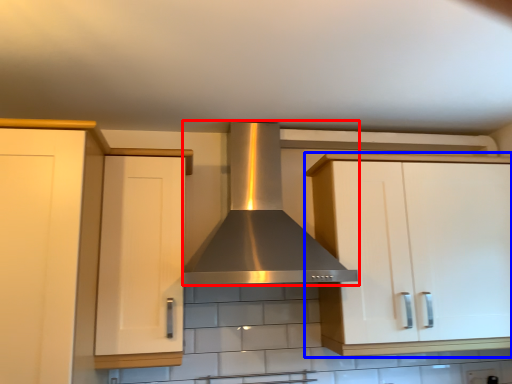
Question: Which object appears closest to the camera in this image, home appliance (highlighted by a red box) or cabinetry (highlighted by a blue box)?

Choices:
 (A) home appliance
 (B) cabinetry

Answer: (A)